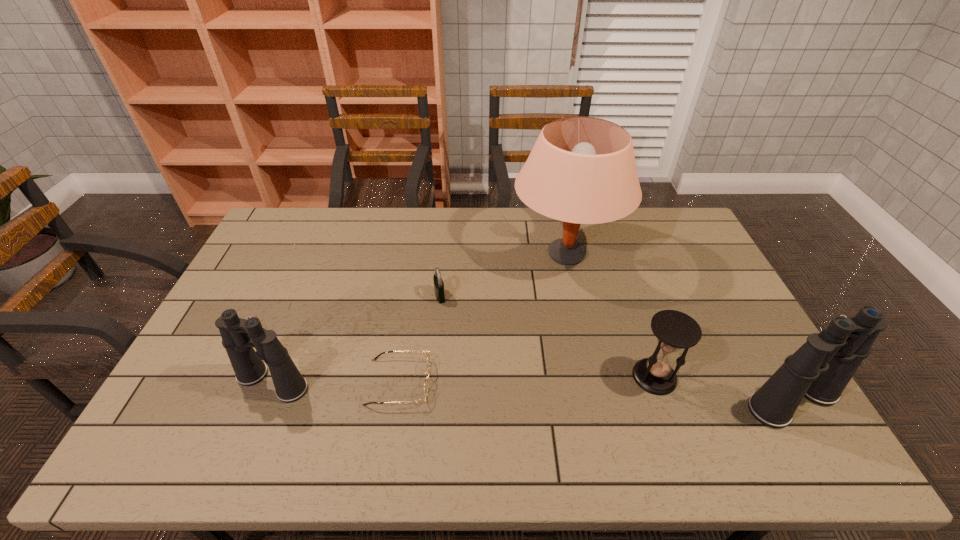
The image size is (960, 540). I want to click on free space between the tallest object and the hourglass, so click(x=611, y=315).

Identify the location of vacant area that lies between the fifth shortest object and the hourglass. (724, 389).

Where is `empty location between the left binoculars and the taller binoculars`? This screenshot has height=540, width=960. empty location between the left binoculars and the taller binoculars is located at coordinates (533, 392).

Where is `free area in between the leftmost object and the fifth tallest object`? The image size is (960, 540). free area in between the leftmost object and the fifth tallest object is located at coordinates (356, 339).

This screenshot has height=540, width=960. Identify the location of vacant area that lies between the fifth tallest object and the lampshade. (503, 275).

The width and height of the screenshot is (960, 540). In order to click on empty location between the tallest object and the hourglass in this screenshot , I will do `click(611, 315)`.

Select which object appears as the fourth closest to the lampshade. Please provide its 2D coordinates. Your answer should be formatted as a tuple, i.e. [(x, y)], where the tuple contains the x and y coordinates of a point satisfying the conditions above.

[(821, 368)]

Identify which object is the third closest to the lampshade. Please provide its 2D coordinates. Your answer should be formatted as a tuple, i.e. [(x, y)], where the tuple contains the x and y coordinates of a point satisfying the conditions above.

[(425, 382)]

Where is `vacant space that satisfies the following two spatial constraints: 1. on the front side of the right binoculars; 2. on the left side of the fifth tallest object`? The height and width of the screenshot is (540, 960). vacant space that satisfies the following two spatial constraints: 1. on the front side of the right binoculars; 2. on the left side of the fifth tallest object is located at coordinates (430, 401).

This screenshot has width=960, height=540. What are the coordinates of `blank space that satisfies the following two spatial constraints: 1. on the front-facing side of the hourglass; 2. on the left side of the tallest object` in the screenshot? It's located at (593, 377).